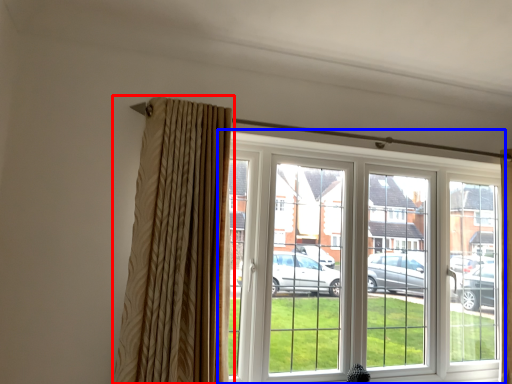
Question: Among these objects, which one is nearest to the camera, curtain (highlighted by a red box) or window (highlighted by a blue box)?

Choices:
 (A) curtain
 (B) window

Answer: (A)